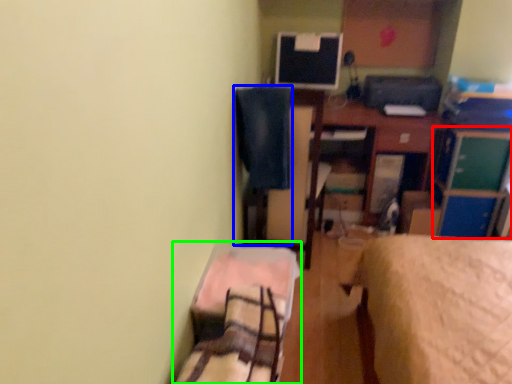
Question: Estimate the real-world distances between objects in this image. Which object is closer to file cabinet (highlighted by a red box), swivel chair (highlighted by a blue box) or bed (highlighted by a green box)?

Choices:
 (A) swivel chair
 (B) bed

Answer: (A)